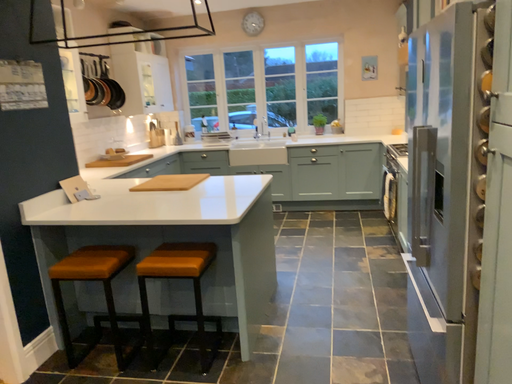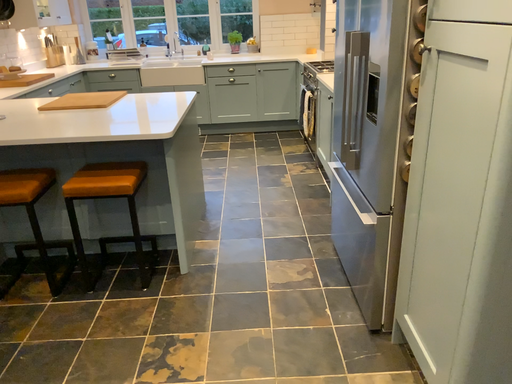
Question: Which way did the camera rotate in the video?

Choices:
 (A) rotated left
 (B) rotated right

Answer: (B)